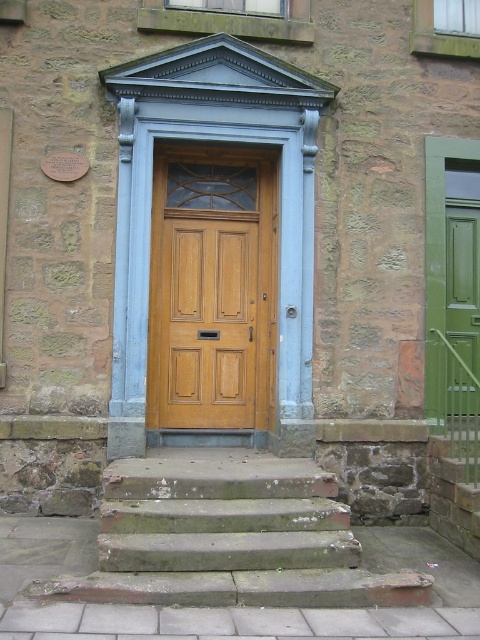
Question: Among these points, which one is nearest to the camera?

Choices:
 (A) pyautogui.click(x=186, y=371)
 (B) pyautogui.click(x=305, y=474)

Answer: (B)

Question: Can you confirm if green stone stairs at center is positioned below wooden door at center?

Choices:
 (A) no
 (B) yes

Answer: (B)

Question: Is green stone stairs at center to the right of wooden door at center from the viewer's perspective?

Choices:
 (A) no
 (B) yes

Answer: (B)

Question: Does green stone stairs at center have a larger size compared to wooden door at center?

Choices:
 (A) no
 (B) yes

Answer: (B)